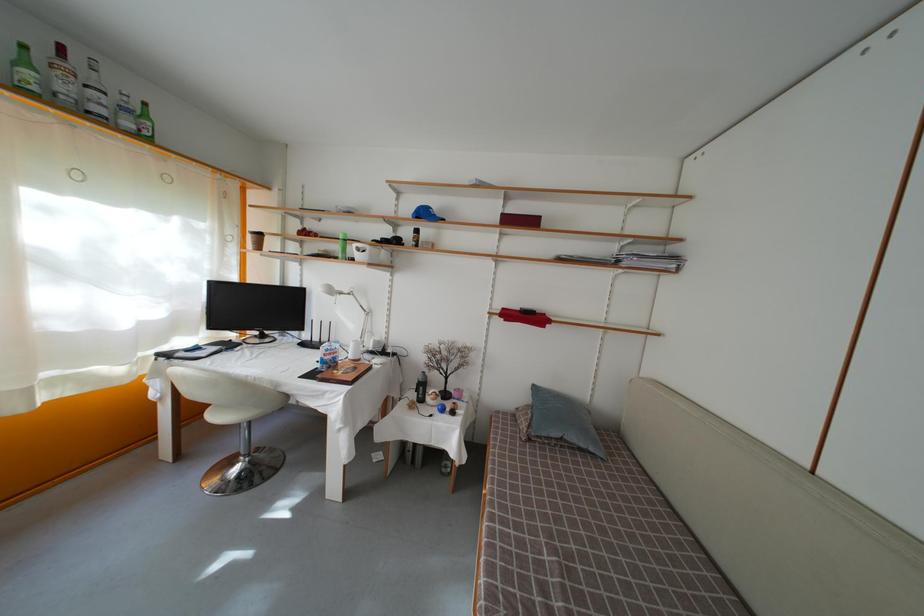
Describe the element at coordinates (348, 305) in the screenshot. The width and height of the screenshot is (924, 616). I see `a desk lamp head` at that location.